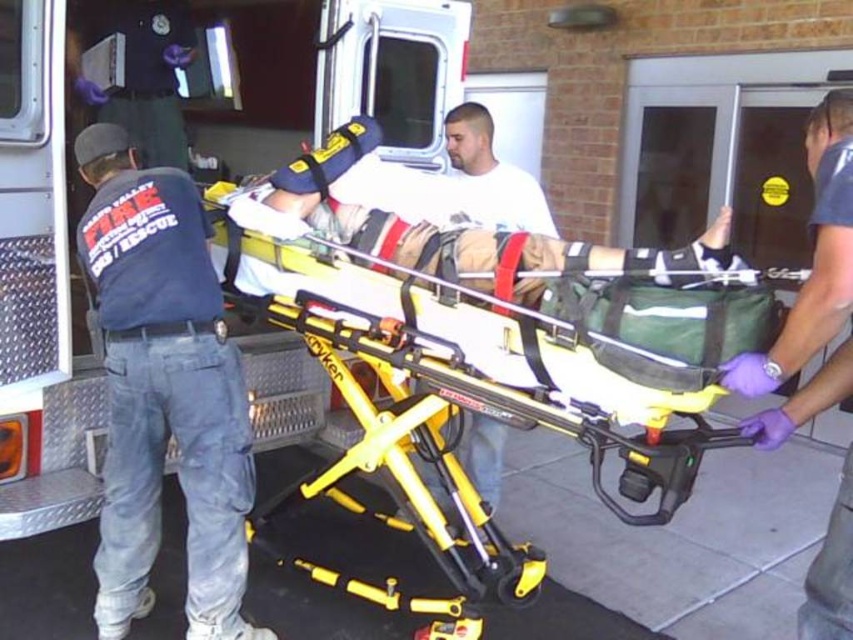
Question: Which object is the farthest from the white matte shirt at center?

Choices:
 (A) yellow metallic stretcher at center
 (B) purple-latex-gloved-hand at right

Answer: (B)

Question: Which point is farther from the camera taking this photo?

Choices:
 (A) (489, 189)
 (B) (120, 508)
 (C) (804, 589)

Answer: (A)

Question: Observing the image, what is the correct spatial positioning of dark blue uniform at left in reference to purple-latex-gloved-hand at right?

Choices:
 (A) right
 (B) left

Answer: (B)

Question: Estimate the real-world distances between objects in this image. Which object is farther from the dark blue uniform at left?

Choices:
 (A) yellow metallic stretcher at center
 (B) white matte shirt at center

Answer: (B)

Question: Is yellow metallic stretcher at center to the right of purple-latex-gloved-hand at right from the viewer's perspective?

Choices:
 (A) no
 (B) yes

Answer: (A)

Question: Is yellow metallic stretcher at center below purple-latex-gloved-hand at right?

Choices:
 (A) no
 (B) yes

Answer: (B)